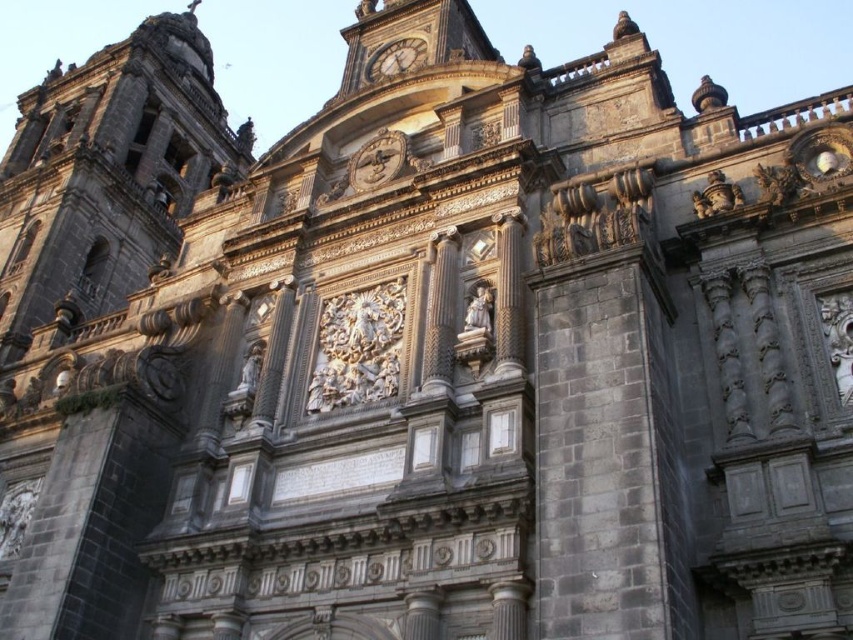
You are standing in front of the cathedral facade and notice two points marked on the image. Which point, point (381, 140) or point (402, 61), is closer to you?

Point (381, 140) is closer to the camera than point (402, 61).

You are standing at the point marked as point [393,154] and want to take a photo of the cathedral facade. If your camera is set to capture a 60 degree field of view, will the entire cathedral facade fit in your photo?

The distance between point [393,154] and the camera is 65.82 meters. To determine if the entire cathedral facade fits in a 60 degree field of view, we need to calculate the required distance. However, without knowing the actual dimensions of the cathedral facade, we cannot confirm if it will fit. The given information only specifies the distance from the point to the camera, not the size of the facade itself.